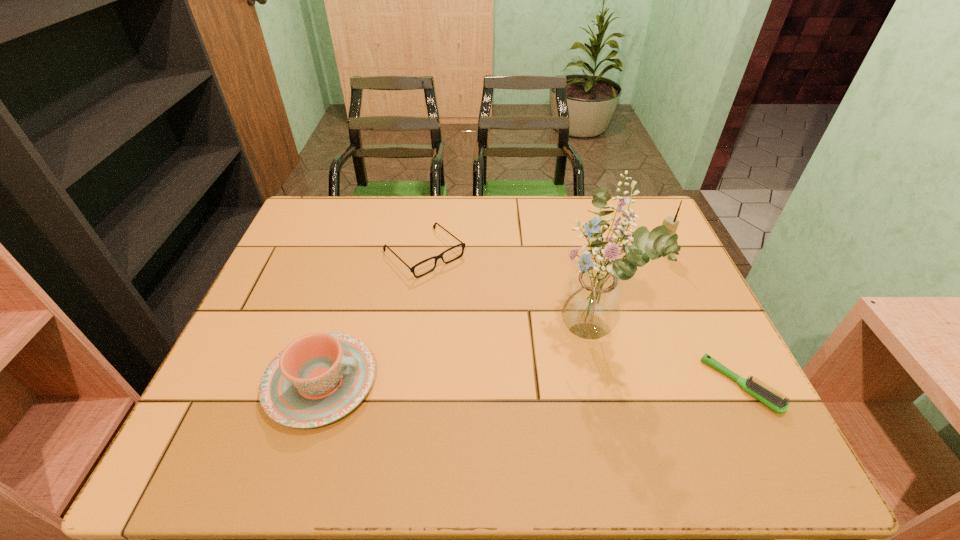
You are a GUI agent. You are given a task and a screenshot of the screen. Output one action in this format:
    pyautogui.click(x=<x>, y=<y>)
    Task: Click on the free space on the desktop that is between the third shortest object and the shortest object and is positioned on the front-facing side of the third object from left to right
    
    Given the screenshot: What is the action you would take?
    pyautogui.click(x=492, y=383)

Image resolution: width=960 pixels, height=540 pixels. I want to click on vacant space on the desktop that is between the chinaware and the hairbrush and is positioned on the front-facing side of the second shortest object, so click(565, 383).

I want to click on vacant spot on the desktop that is between the third tallest object and the shortest object and is positioned on the front of the cellular telephone, where the keypad is located, so click(x=492, y=383).